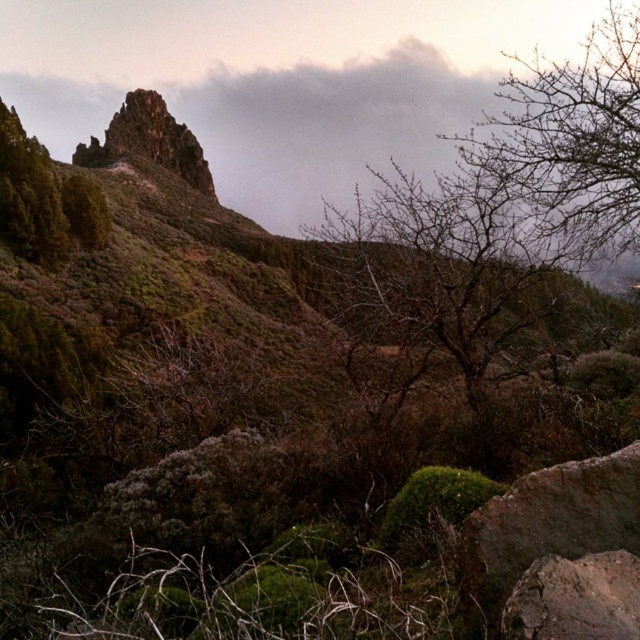
Is bare branches at upper right to the right of rusty rock at lower right from the viewer's perspective?

Correct, you'll find bare branches at upper right to the right of rusty rock at lower right.

Does point (621, 138) come closer to viewer compared to point (604, 474)?

No.

What are the coordinates of `bare branches at upper right` in the screenshot? It's located at click(x=573, y=138).

Can you confirm if rusty rock at lower right is taller than green matte rock at upper left?

Incorrect, rusty rock at lower right's height is not larger of green matte rock at upper left's.

Does point (528, 563) come farther from viewer compared to point (104, 224)?

No, (528, 563) is in front of (104, 224).

Find the location of a particular element. Image resolution: width=640 pixels, height=640 pixels. rusty rock at lower right is located at coordinates (548, 522).

Is point (548, 80) positioned behind point (604, 609)?

Yes.

Between bare branches at upper right and rusty metallic rock at lower right, which one appears on the right side from the viewer's perspective?

bare branches at upper right

Locate an element on the screen. Image resolution: width=640 pixels, height=640 pixels. bare branches at upper right is located at coordinates (573, 138).